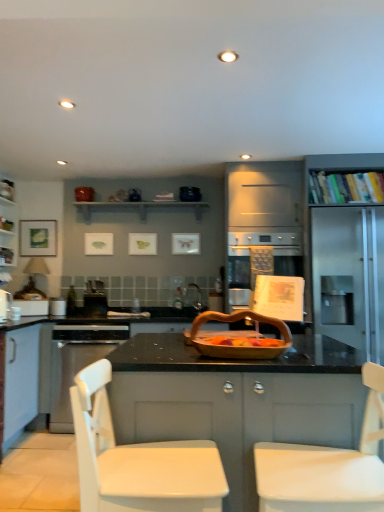
Question: Considering the positions of wooden basket at center and white glossy cabinet at left, placed as the first cabinetry when sorted from left to right, in the image, is wooden basket at center bigger or smaller than white glossy cabinet at left, placed as the first cabinetry when sorted from left to right,?

Choices:
 (A) big
 (B) small

Answer: (B)

Question: Considering the positions of wooden basket at center and white glossy cabinet at left, placed as the first cabinetry when sorted from left to right, in the image, is wooden basket at center wider or thinner than white glossy cabinet at left, placed as the first cabinetry when sorted from left to right,?

Choices:
 (A) thin
 (B) wide

Answer: (B)

Question: Which object is positioned closest to the hardcover books at upper right, which is the 1th shelf from front to back?

Choices:
 (A) white matte cabinet at center, the second cabinetry positioned from the back
 (B) matte black shelf at upper center, the 1th shelf viewed from the back
 (C) wooden basket at center
 (D) white matte chair at lower right, acting as the 1th chair starting from the right
 (E) metallic silver toaster at left, arranged as the second appliance when viewed from the back

Answer: (B)

Question: Which object is positioned farthest from the metallic silver toaster at left, arranged as the second appliance when viewed from the back?

Choices:
 (A) matte black shelf at upper center, the second shelf from the front
 (B) brushed metal toaster at center, the 1th appliance positioned from the back
 (C) wooden basket at center
 (D) white glossy cabinet at left, placed as the 1th cabinetry when sorted from top to bottom
 (E) white matte cabinet at center, marked as the second cabinetry in a top-to-bottom arrangement

Answer: (E)